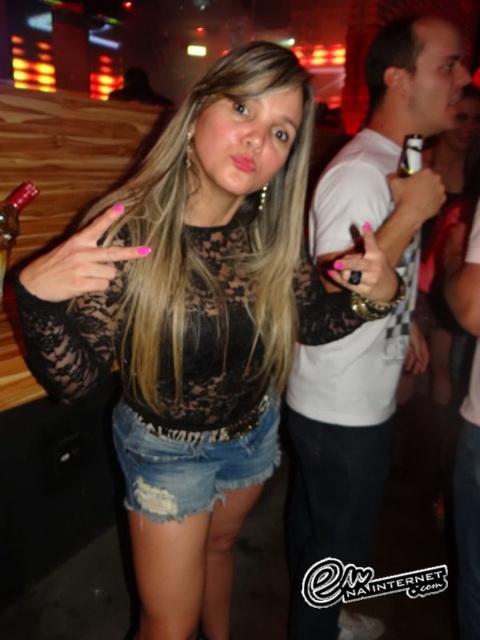
You are taking a photo of the nightclub scene. You want to focus on the point that is closer to the camera. Which point should you choose between point (85, 284) and point (6, 196)?

Point (85, 284) is closer to the camera than point (6, 196), so you should choose point (85, 284) to focus on.

You are at a nightclub and want to move from the point closer to the front of the scene to the point further back. Which path would you take between the two points, point (x=330, y=348) and point (x=142, y=449)?

To move from the closer point to the further one, you should go from point (x=142, y=449) to point (x=330, y=348) because point (x=330, y=348) is further to the viewer, meaning point (x=142, y=449) is further back.